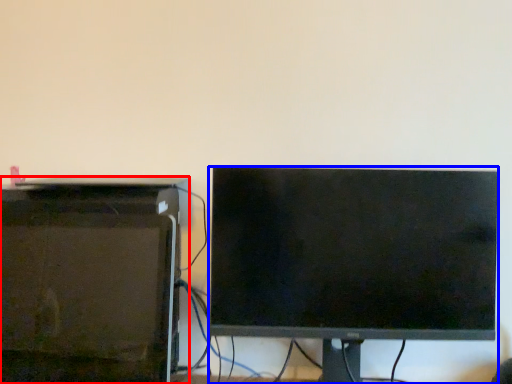
Question: Among these objects, which one is farthest to the camera, desktop computer (highlighted by a red box) or computer monitor (highlighted by a blue box)?

Choices:
 (A) desktop computer
 (B) computer monitor

Answer: (B)